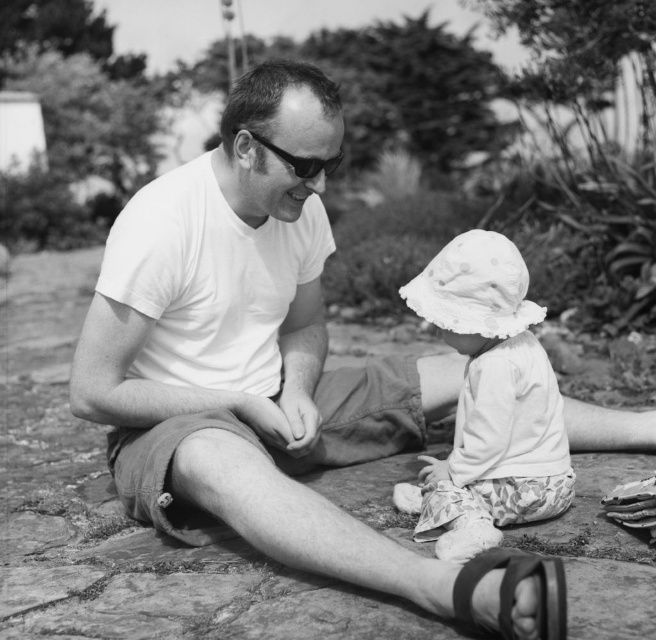
Question: Among these objects, which one is farthest from the camera?

Choices:
 (A) black plastic goggles at center
 (B) black leather sandal at lower center

Answer: (A)

Question: Among these objects, which one is nearest to the camera?

Choices:
 (A) black plastic goggles at center
 (B) black leather sandal at lower center

Answer: (B)

Question: Which of these objects is positioned farthest from the black leather sandal at lower center?

Choices:
 (A) black plastic goggles at center
 (B) white dotted fabric hat at center

Answer: (A)

Question: Is black leather sandal at lower center to the left of black plastic goggles at center from the viewer's perspective?

Choices:
 (A) no
 (B) yes

Answer: (A)

Question: Is black leather sandal at lower center positioned before black plastic goggles at center?

Choices:
 (A) no
 (B) yes

Answer: (B)

Question: Does black leather sandal at lower center have a larger size compared to black plastic goggles at center?

Choices:
 (A) no
 (B) yes

Answer: (A)